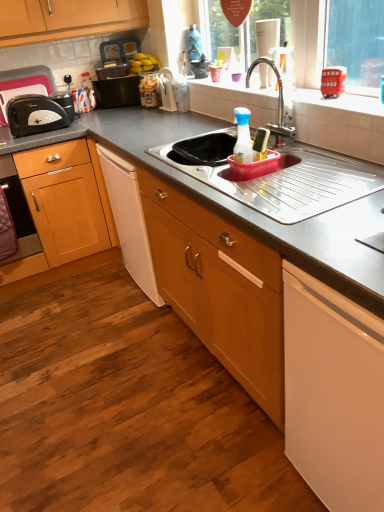
I want to click on vacant space situated on the left part of white plastic bottle at sink, so click(198, 172).